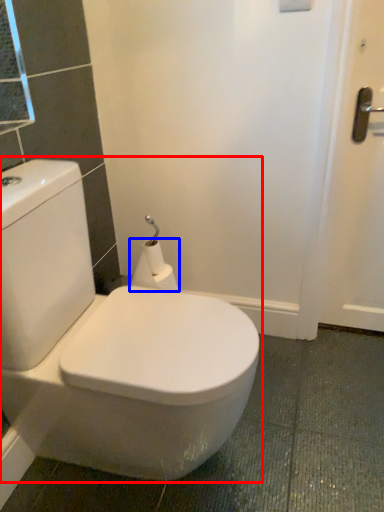
Question: Which object is further to the camera taking this photo, toilet (highlighted by a red box) or toilet paper (highlighted by a blue box)?

Choices:
 (A) toilet
 (B) toilet paper

Answer: (B)